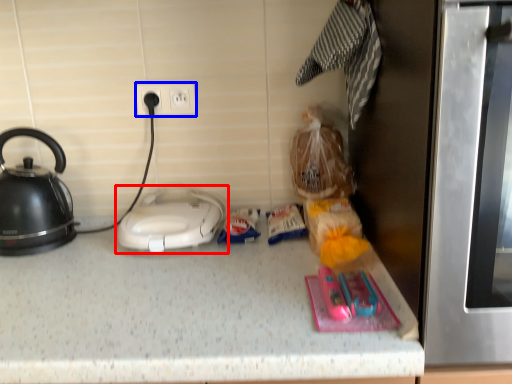
Question: Among these objects, which one is farthest to the camera, home appliance (highlighted by a red box) or electric outlet (highlighted by a blue box)?

Choices:
 (A) home appliance
 (B) electric outlet

Answer: (B)